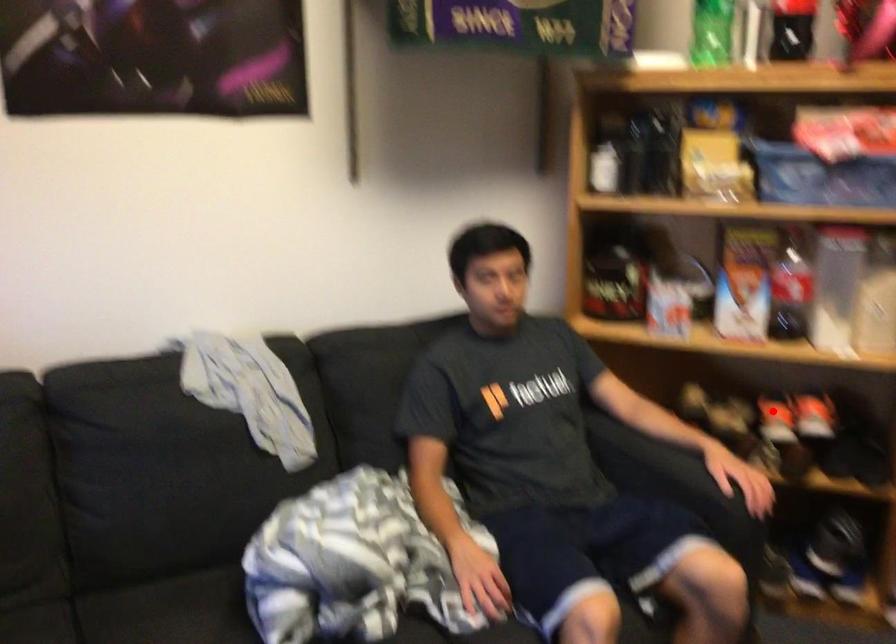
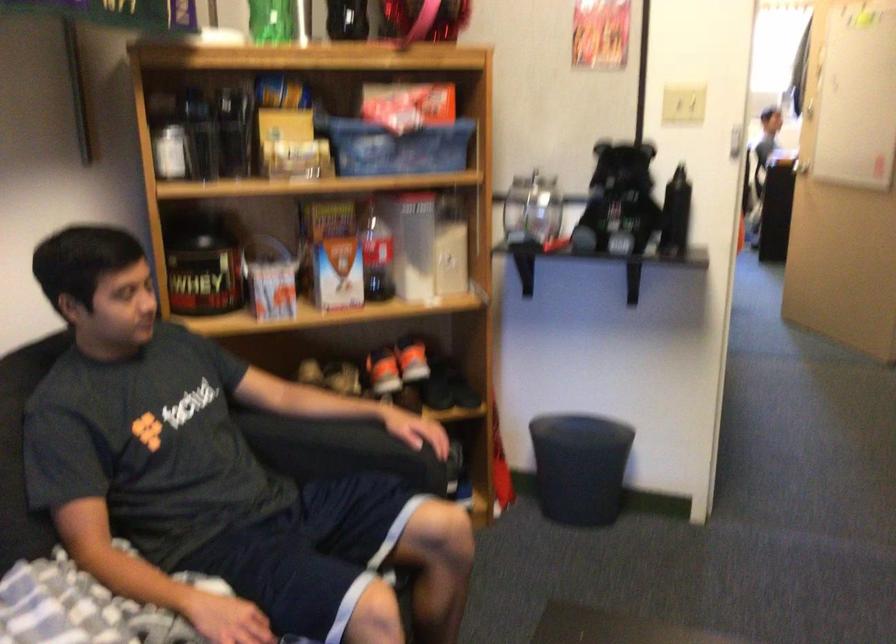
In the second image, find the point that corresponds to the highlighted location in the first image.

(383, 371)